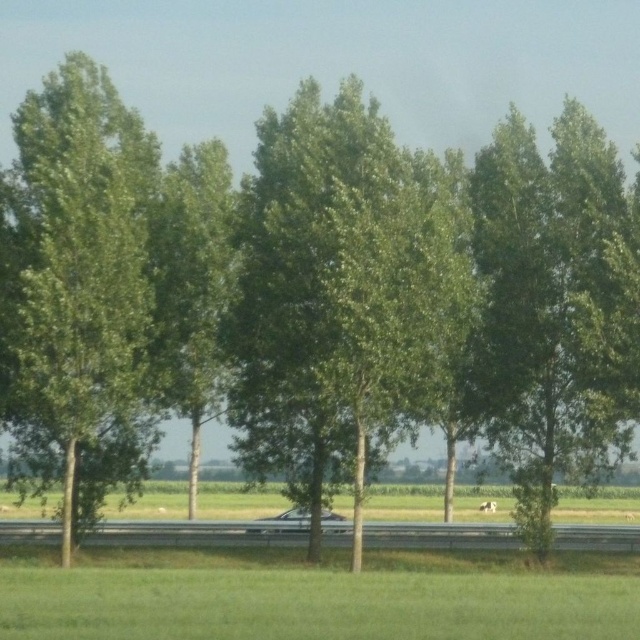
Question: Can you confirm if green leafy tree at center is positioned to the left of green grass at lower center?

Choices:
 (A) no
 (B) yes

Answer: (A)

Question: Which of the following is the farthest from the observer?

Choices:
 (A) (65, 189)
 (B) (436, 212)
 (C) (422, 605)

Answer: (B)

Question: Which point is farther from the camera taking this photo?

Choices:
 (A) (609, 564)
 (B) (104, 316)
 (C) (326, 128)

Answer: (A)

Question: From the image, what is the correct spatial relationship of green leafy tree at center in relation to green grass at lower center?

Choices:
 (A) left
 (B) right

Answer: (B)

Question: Which of the following is the farthest from the observer?

Choices:
 (A) (36, 328)
 (B) (540, 618)
 (C) (314, 323)

Answer: (C)

Question: Does green leafy tree at center appear over green grass at lower center?

Choices:
 (A) no
 (B) yes

Answer: (B)